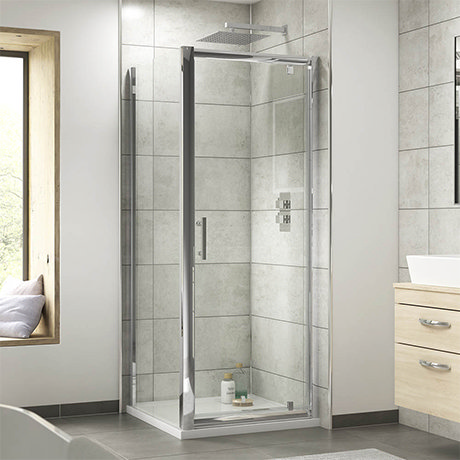
This screenshot has width=460, height=460. Identify the location of bathroom. [x=226, y=410].